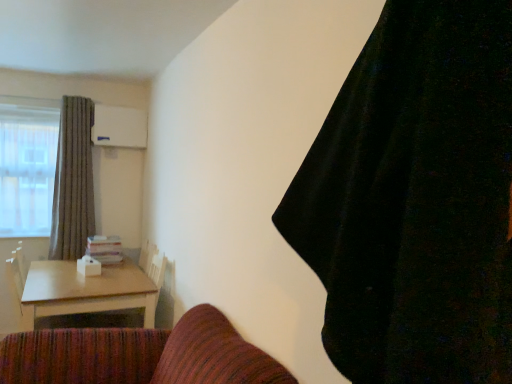
Question: Is gray textured curtain at left, which appears as the second curtain when viewed from the right, situated inside light brown wooden table at lower left or outside?

Choices:
 (A) inside
 (B) outside

Answer: (B)

Question: Is gray textured curtain at left, the first curtain in the back-to-front sequence, to the left or to the right of light brown wooden table at lower left in the image?

Choices:
 (A) right
 (B) left

Answer: (B)

Question: Which object is the closest to the black velvet curtain at upper right, marked as the 2th curtain in a back-to-front arrangement?

Choices:
 (A) gray textured curtain at left, marked as the first curtain in a left-to-right arrangement
 (B) light brown wooden table at lower left

Answer: (B)

Question: Based on their relative distances, which object is farther from the gray textured curtain at left, marked as the first curtain in a left-to-right arrangement?

Choices:
 (A) light brown wooden table at lower left
 (B) black velvet curtain at upper right, which is the 1th curtain from front to back

Answer: (B)